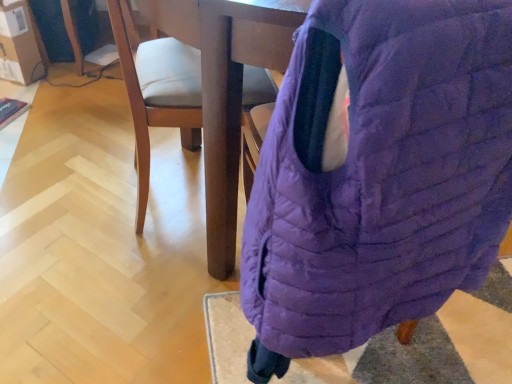
Where is `vacant area that is in front of light brown wood chair at center`? The image size is (512, 384). vacant area that is in front of light brown wood chair at center is located at coordinates (132, 268).